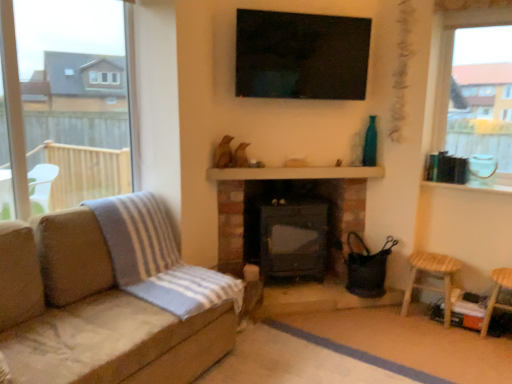
Find the location of `empty space that is ontop of wooden balustrade at center (from a real-world perspective)`. empty space that is ontop of wooden balustrade at center (from a real-world perspective) is located at coordinates tap(284, 159).